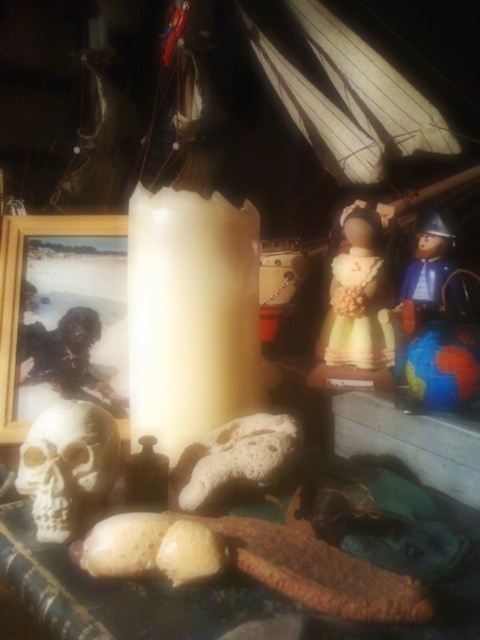
Can you confirm if white matte skull at lower left is positioned to the right of wooden photo frame at left?

Correct, you'll find white matte skull at lower left to the right of wooden photo frame at left.

Can you confirm if white matte skull at lower left is positioned to the left of wooden photo frame at left?

No, white matte skull at lower left is not to the left of wooden photo frame at left.

Where is `white matte skull at lower left`? This screenshot has width=480, height=640. white matte skull at lower left is located at coordinates (68, 467).

Identify the location of white matte skull at lower left. (68, 467).

Between matte yellow doll at center and wooden photo frame at left, which one appears on the left side from the viewer's perspective?

wooden photo frame at left is more to the left.

How much distance is there between matte yellow doll at center and wooden photo frame at left?

matte yellow doll at center and wooden photo frame at left are 13.05 inches apart from each other.

Between point (339, 308) and point (79, 214), which one is positioned behind?

Point (79, 214)

Locate an element on the screen. matte yellow doll at center is located at coordinates (358, 296).

Who is shorter, white matte candle at center or white matte skull at lower left?

white matte skull at lower left is shorter.

Who is more distant from viewer, (131, 330) or (106, 461)?

Positioned behind is point (131, 330).

Locate an element on the screen. This screenshot has height=640, width=480. white matte candle at center is located at coordinates (191, 316).